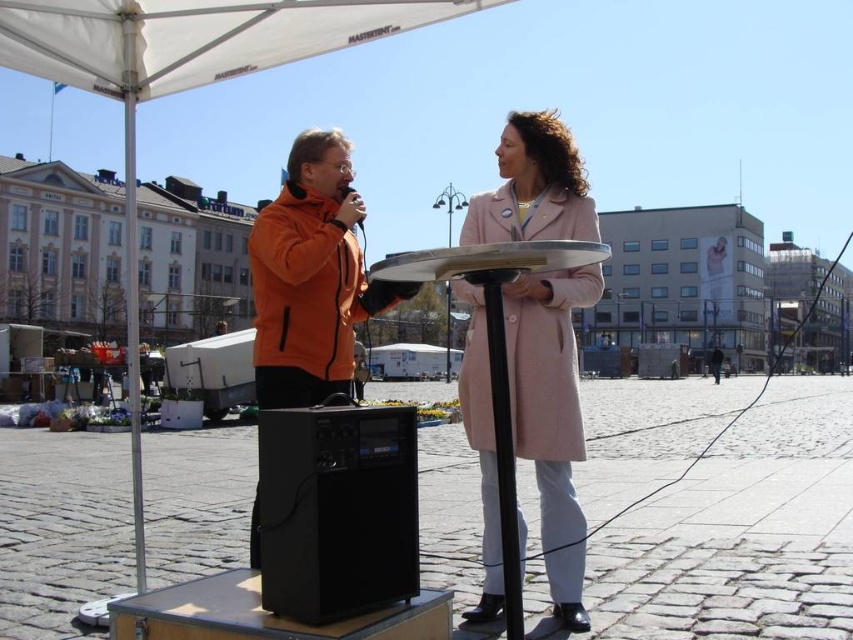
Question: Does black plastic speaker at center come behind black plastic speaker at lower left?

Choices:
 (A) yes
 (B) no

Answer: (A)

Question: Based on their relative distances, which object is farther from the black plastic speaker at center?

Choices:
 (A) white fabric canopy at upper center
 (B) orange fleece jacket at center

Answer: (A)

Question: Can you confirm if pink wool coat at center is positioned below black plastic speaker at lower left?

Choices:
 (A) no
 (B) yes

Answer: (A)

Question: Which of the following is the closest to the observer?

Choices:
 (A) (79, 49)
 (B) (341, 368)
 (C) (344, 202)
 (D) (245, 616)

Answer: (D)

Question: Among these points, which one is nearest to the camera?

Choices:
 (A) (279, 205)
 (B) (161, 67)

Answer: (A)

Question: In this image, where is orange fleece jacket at left located relative to black plastic speaker at lower left?

Choices:
 (A) below
 (B) above

Answer: (B)